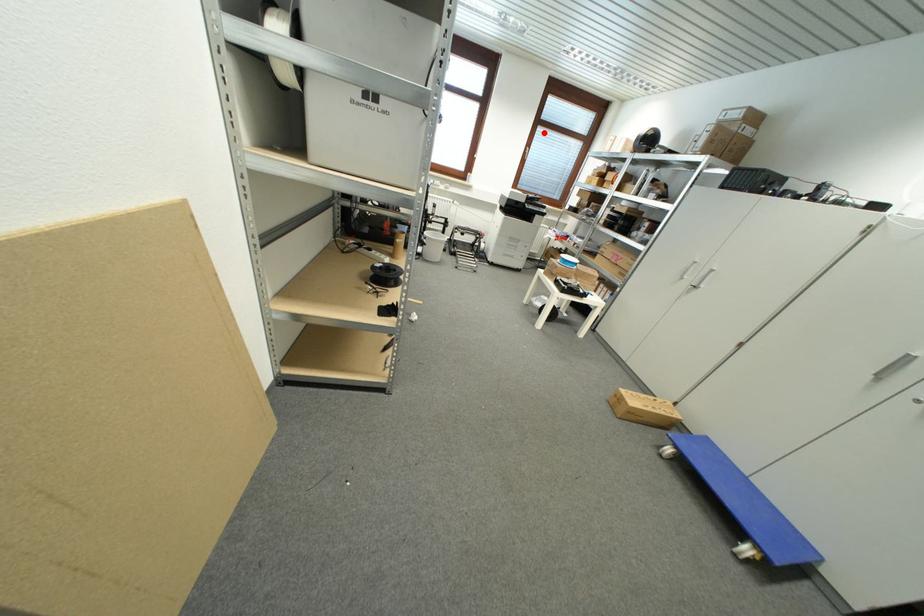
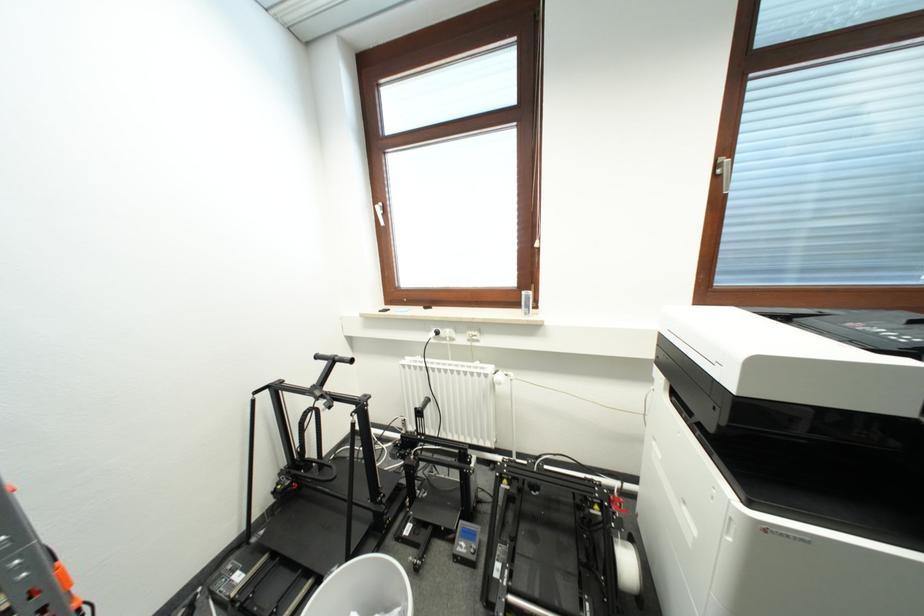
Question: I am providing you with two images of the same scene from different viewpoints. A red point is marked on the first image. At the location where the point appears in image 1, is it still visible in image 2?

Choices:
 (A) Yes
 (B) No

Answer: (A)